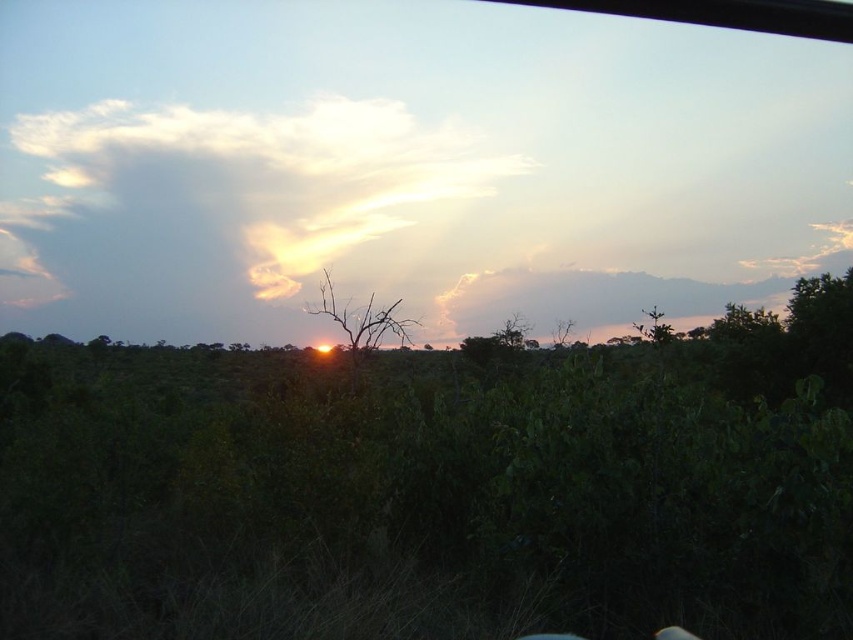
Question: Which object appears closest to the camera in this image?

Choices:
 (A) brown dry at center
 (B) brown textured tree at center
 (C) cloudy sky at upper center

Answer: (A)

Question: Is cloudy sky at upper center bigger than brown dry at center?

Choices:
 (A) yes
 (B) no

Answer: (A)

Question: Can you confirm if brown dry at center is smaller than brown textured tree at center?

Choices:
 (A) no
 (B) yes

Answer: (A)

Question: Which object is positioned closest to the brown textured tree at center?

Choices:
 (A) brown dry at center
 (B) cloudy sky at upper center

Answer: (A)

Question: Which point is farther to the camera?

Choices:
 (A) (78, 234)
 (B) (344, 326)
 (C) (512, 339)

Answer: (A)

Question: Can you confirm if cloudy sky at upper center is thinner than brown dry at center?

Choices:
 (A) yes
 (B) no

Answer: (B)